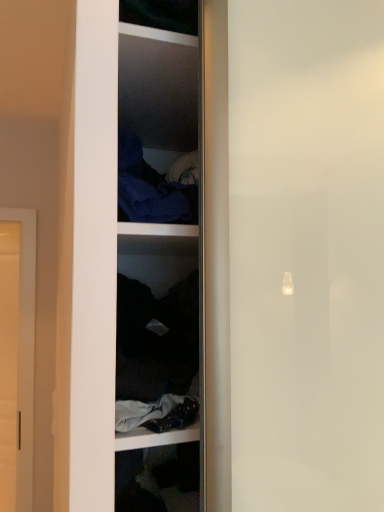
Find the location of a particular element. matte white door at left is located at coordinates (17, 357).

The image size is (384, 512). In order to click on dark fabric at center in this screenshot , I will do `click(162, 294)`.

What is the approximate width of dark fabric at center?

dark fabric at center is 19.34 inches wide.

The width and height of the screenshot is (384, 512). What are the coordinates of `dark blue fabric at upper center` in the screenshot? It's located at (160, 112).

Is dark fabric at center beside dark blue fabric at upper center?

No, dark fabric at center is not next to dark blue fabric at upper center.

Based on their sizes in the image, would you say dark fabric at center is bigger or smaller than dark blue fabric at upper center?

In the image, dark fabric at center appears to be larger than dark blue fabric at upper center.

From the image's perspective, relative to dark blue fabric at upper center, is dark fabric at center above or below?

Clearly, from the image's perspective, dark fabric at center is below dark blue fabric at upper center.

Considering the sizes of dark fabric at center and matte white door at left in the image, is dark fabric at center wider or thinner than matte white door at left?

In the image, dark fabric at center appears to be wider than matte white door at left.

Do you think dark fabric at center is within matte white door at left, or outside of it?

dark fabric at center is spatially situated outside matte white door at left.

From the image's perspective, is dark fabric at center positioned above or below matte white door at left?

Based on their image positions, dark fabric at center is located above matte white door at left.

In the scene shown: Visually, is dark fabric at center positioned to the left or to the right of matte white door at left?

dark fabric at center is positioned on matte white door at left's right side.

Is dark blue fabric at upper center touching matte white door at left?

No, dark blue fabric at upper center is not in contact with matte white door at left.

Is point (127, 23) positioned in front of point (18, 503)?

Yes, point (127, 23) is closer to viewer.

Is dark blue fabric at upper center inside the boundaries of matte white door at left, or outside?

dark blue fabric at upper center is not inside matte white door at left, it's outside.

Which of these two, dark blue fabric at upper center or matte white door at left, is smaller?

A: dark blue fabric at upper center is smaller.

I want to click on shelf in front of the dark blue fabric at upper center, so click(162, 294).

Is dark blue fabric at upper center not near dark fabric at center?

That's not correct — dark blue fabric at upper center is a little close to dark fabric at center.

Is dark blue fabric at upper center wider than dark fabric at center?

No.

Considering the positions of objects matte white door at left and dark blue fabric at upper center in the image provided, who is more to the right, matte white door at left or dark blue fabric at upper center?

dark blue fabric at upper center.

Is point (7, 237) closer or farther from the camera than point (161, 66)?

Point (7, 237).

From the image's perspective, relative to dark blue fabric at upper center, is matte white door at left above or below?

Based on their image positions, matte white door at left is located beneath dark blue fabric at upper center.

Which is in front, matte white door at left or dark fabric at center?

dark fabric at center.

Does matte white door at left touch dark fabric at center?

No, matte white door at left is not beside dark fabric at center.

Considering the sizes of objects matte white door at left and dark fabric at center in the image provided, who is smaller, matte white door at left or dark fabric at center?

With smaller size is dark fabric at center.

How many degrees apart are the facing directions of matte white door at left and dark fabric at center?

29.3 degrees separate the facing orientations of matte white door at left and dark fabric at center.

You are a GUI agent. You are given a task and a screenshot of the screen. Output one action in this format:
    pyautogui.click(x=<x>, y=<y>)
    Task: Click on the shelf below the dark blue fabric at upper center (from a real-world perspective)
    
    Given the screenshot: What is the action you would take?
    pyautogui.click(x=162, y=294)

The image size is (384, 512). In order to click on shelf in front of the matte white door at left in this screenshot , I will do pos(162,294).

Based on their spatial positions, is matte white door at left or dark fabric at center further from dark blue fabric at upper center?

matte white door at left is further to dark blue fabric at upper center.

Based on the photo, based on their spatial positions, is dark fabric at center or dark blue fabric at upper center further from matte white door at left?

dark blue fabric at upper center is positioned further to the anchor matte white door at left.

Considering their positions, is dark fabric at center positioned further to dark blue fabric at upper center than matte white door at left?

matte white door at left is further to dark blue fabric at upper center.

Looking at the image, which one is located further to dark fabric at center, matte white door at left or dark blue fabric at upper center?

matte white door at left is positioned further to the anchor dark fabric at center.

Looking at the image, which one is located closer to matte white door at left, dark blue fabric at upper center or dark fabric at center?

dark fabric at center is positioned closer to the anchor matte white door at left.

From the picture: Considering their positions, is dark blue fabric at upper center positioned further to dark fabric at center than matte white door at left?

The object further to dark fabric at center is matte white door at left.

In order to click on cabinet between dark fabric at center and matte white door at left in the front-back direction in this screenshot , I will do `click(160, 112)`.